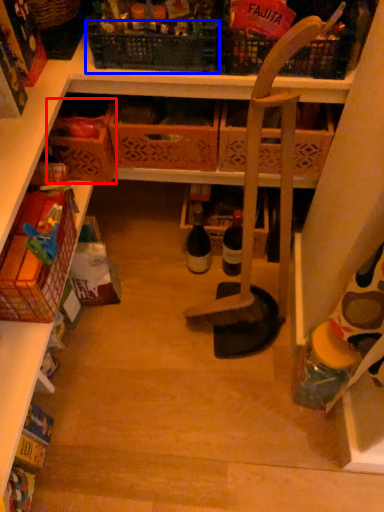
Question: Which point is further to the camera, basket (highlighted by a red box) or basket (highlighted by a blue box)?

Choices:
 (A) basket
 (B) basket

Answer: (A)